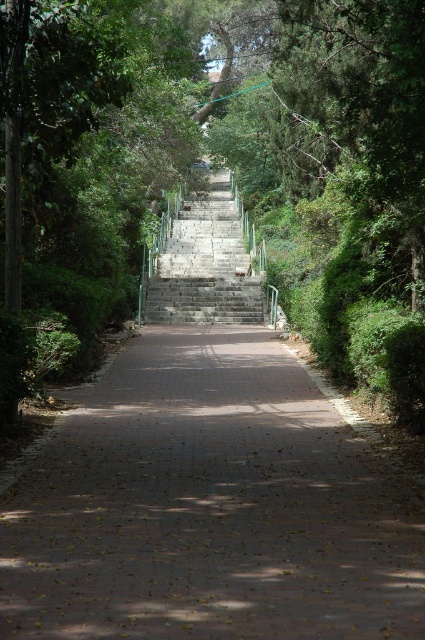
Which is more to the right, brown brick path at center or gray stone stairs at center?

brown brick path at center

Does point (224, 628) lie behind point (152, 308)?

No, it is in front of (152, 308).

You are a GUI agent. You are given a task and a screenshot of the screen. Output one action in this format:
    pyautogui.click(x=<x>, y=<y>)
    Task: Click on the brown brick path at center
    
    Given the screenshot: What is the action you would take?
    pyautogui.click(x=209, y=508)